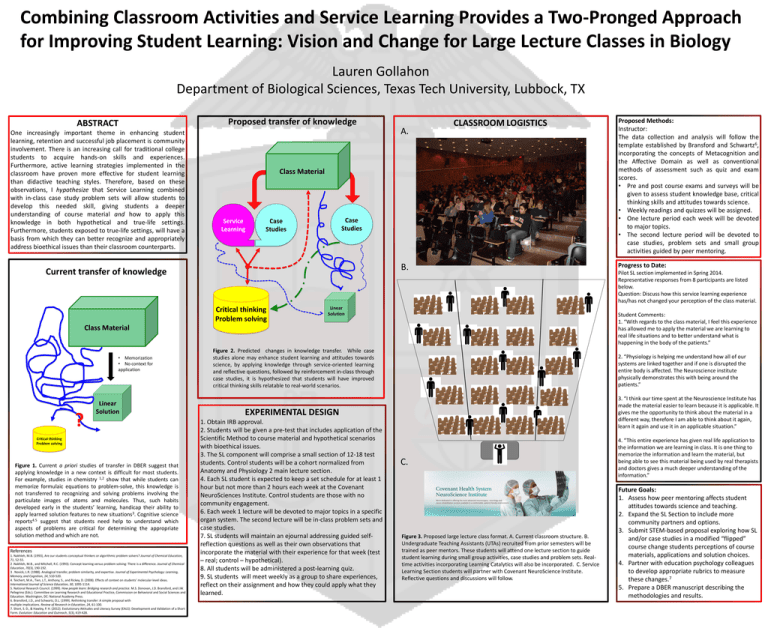
This screenshot has width=768, height=628. I want to click on stairs, so click(551, 245).